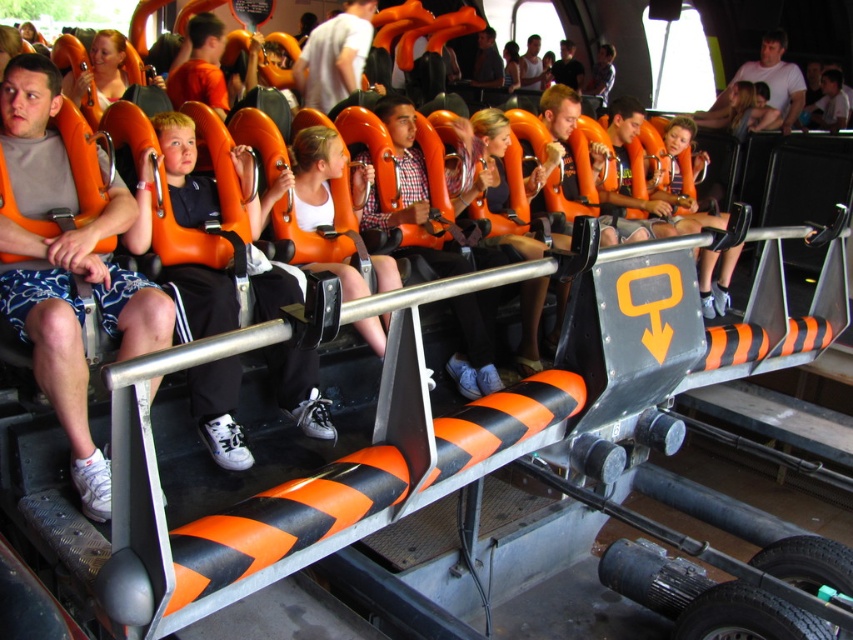
Question: Which object is closer to the camera taking this photo?

Choices:
 (A) matte black shirt at center
 (B) matte white shirt at center
 (C) matte white shirt at upper center
 (D) black matte shirt at center

Answer: (B)

Question: Which is nearer to the matte white shirt at upper center?

Choices:
 (A) matte white shirt at center
 (B) matte orange life vest at center
 (C) matte black shirt at center

Answer: (C)

Question: Does matte white shirt at upper center appear on the right side of matte black shirt at center?

Choices:
 (A) no
 (B) yes

Answer: (B)

Question: Does matte white shirt at center come in front of matte black shirt at center?

Choices:
 (A) no
 (B) yes

Answer: (B)

Question: Which of the following is the farthest from the observer?

Choices:
 (A) black matte shirt at center
 (B) matte white shirt at upper center
 (C) matte gray shorts at left
 (D) matte black shirt at center

Answer: (A)

Question: Is matte gray shorts at left in front of matte white shirt at center?

Choices:
 (A) yes
 (B) no

Answer: (A)